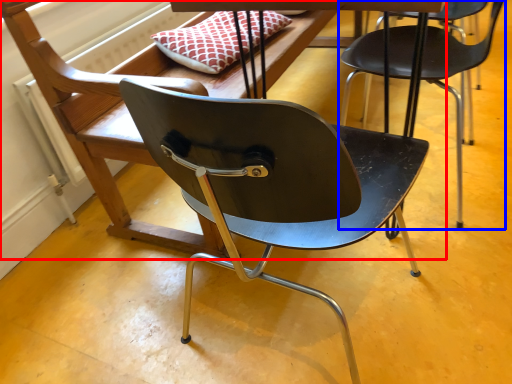
Question: Which of the following is the farthest to the observer, chair (highlighted by a red box) or chair (highlighted by a blue box)?

Choices:
 (A) chair
 (B) chair

Answer: (B)